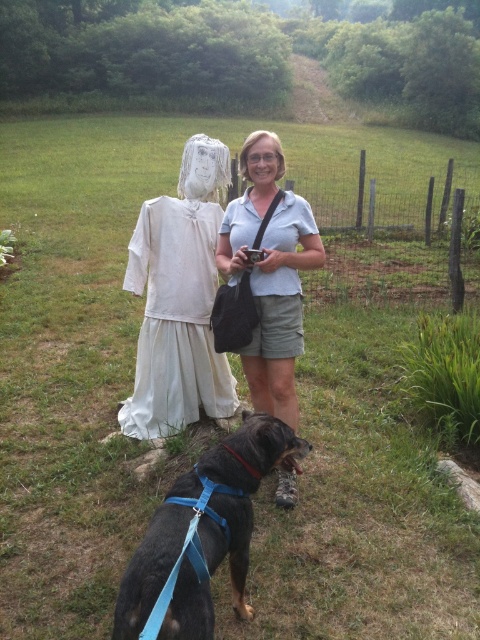
Question: Considering the relative positions of black textured dog at lower center and white cotton dress at left in the image provided, where is black textured dog at lower center located with respect to white cotton dress at left?

Choices:
 (A) above
 (B) below

Answer: (B)

Question: Which point is farther from the camera taking this photo?

Choices:
 (A) (181, 637)
 (B) (275, 184)
 (C) (189, 300)

Answer: (C)

Question: Which object appears closest to the camera in this image?

Choices:
 (A) black textured dog at lower center
 (B) light blue cotton shirt at center

Answer: (A)

Question: Is black textured dog at lower center positioned at the back of light blue cotton shirt at center?

Choices:
 (A) no
 (B) yes

Answer: (A)

Question: Among these objects, which one is nearest to the camera?

Choices:
 (A) white cotton dress at left
 (B) light blue cotton shirt at center
 (C) black textured dog at lower center

Answer: (C)

Question: Is black textured dog at lower center wider than light blue cotton shirt at center?

Choices:
 (A) yes
 (B) no

Answer: (A)